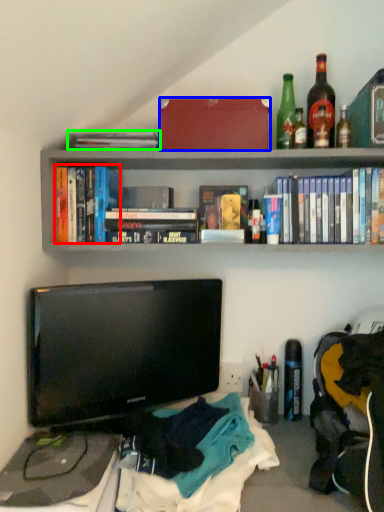
Question: Which is farther away from book (highlighted by a red box)? box (highlighted by a blue box) or book (highlighted by a green box)?

Choices:
 (A) box
 (B) book

Answer: (A)